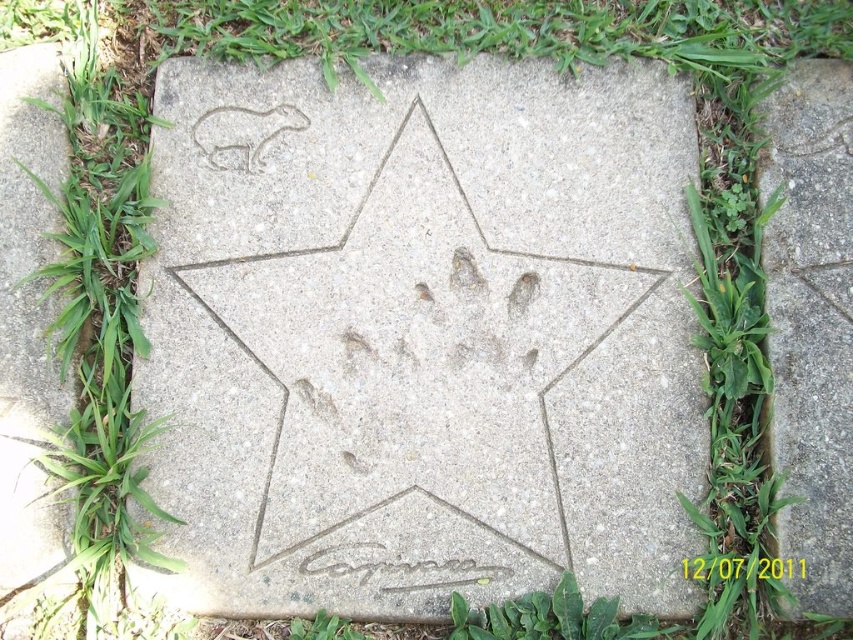
Is point (64, 378) farther from viewer compared to point (248, 128)?

No, (64, 378) is in front of (248, 128).

From the picture: Does green leafy grass at upper left have a smaller size compared to white stone carving at upper left?

No, green leafy grass at upper left is not smaller than white stone carving at upper left.

Is point (132, 323) positioned behind point (265, 132)?

No, it is in front of (265, 132).

At what (x,y) coordinates should I click in order to perform the action: click on green leafy grass at upper left. Please return your answer as a coordinate pair (x, y). The image size is (853, 640). Looking at the image, I should click on (102, 308).